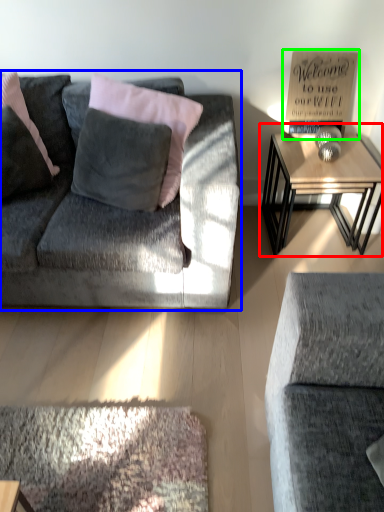
Question: Which object is the closest to the table (highlighted by a red box)? Choose among these: studio couch (highlighted by a blue box) or bulletin board (highlighted by a green box).

Choices:
 (A) studio couch
 (B) bulletin board

Answer: (B)